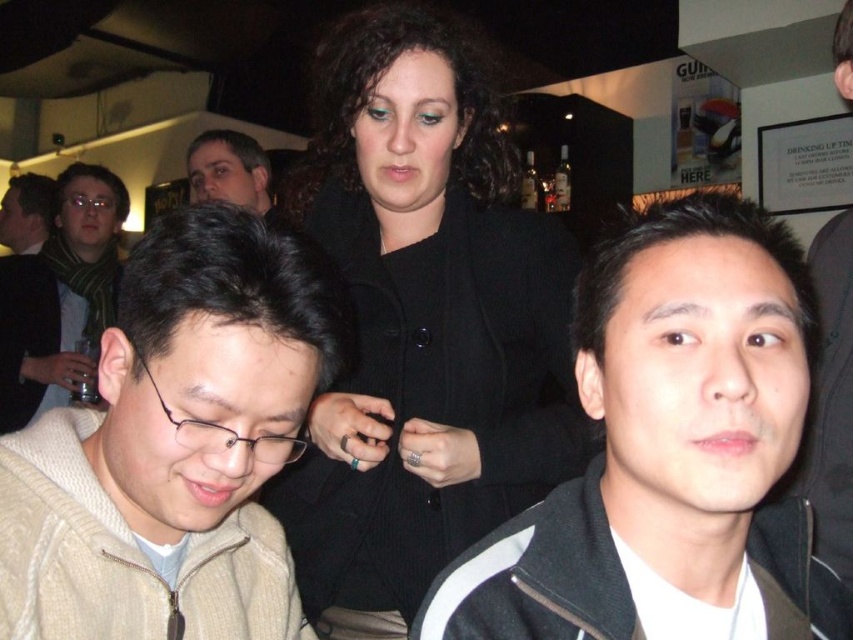
You are standing at the camera position and want to reach the point at coordinates (129, 532). Is this point within arm reach? Assume your arm can extend 50 centimeters.

The point at coordinates (129, 532) is 60.58 centimeters away from the camera. Since your arm can only extend 50 centimeters, you cannot reach it.

You are a fashion designer observing the scene. You need to determine which item is taller between the black matte jacket at center and the matte black glasses at left. Based on the scene description, which item is taller?

The matte black glasses at left are taller than the black matte jacket at center according to the description.

You are a photographer standing at the camera position. You want to take a closeup shot of the beige knitted sweater at lower left. Is the sweater within the focus range of your camera which has a minimum focusing distance of 18 inches?

The beige knitted sweater at lower left is 19.65 inches away from the camera, which is just beyond the minimum focusing distance of 18 inches. Therefore, you might need to adjust your position or use a different lens to capture a clear closeup.